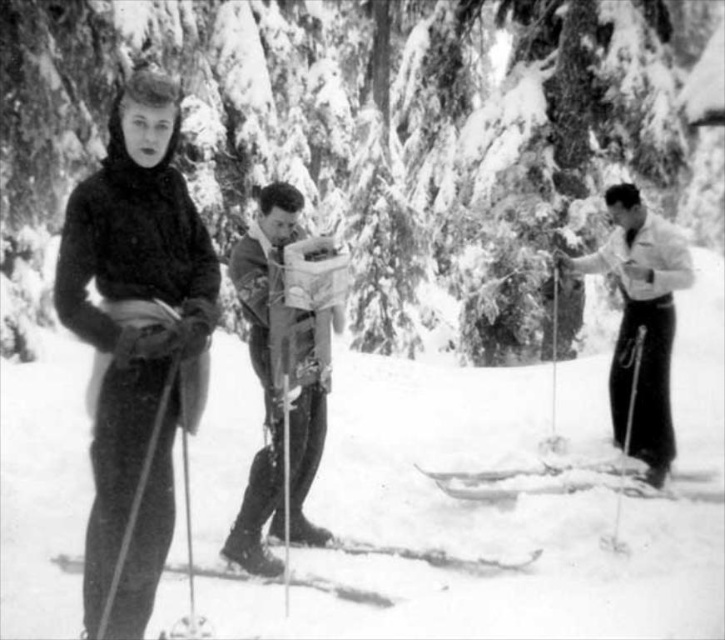
Question: Can you confirm if smooth snow at center is positioned to the left of smooth wood skis at center?

Choices:
 (A) yes
 (B) no

Answer: (B)

Question: Can you confirm if snowy evergreen tree at center is positioned to the right of smooth snow at center?

Choices:
 (A) yes
 (B) no

Answer: (A)

Question: Considering the real-world distances, which object is closest to the black matte ski suit at left?

Choices:
 (A) metallic ski pole at left
 (B) smooth snow at center

Answer: (A)

Question: Does white glossy skis at right have a greater width compared to metallic ski pole at left?

Choices:
 (A) yes
 (B) no

Answer: (A)

Question: Which of the following is the closest to the observer?

Choices:
 (A) (219, 340)
 (B) (624, 435)
 (C) (256, 538)

Answer: (C)

Question: Which point is closer to the camera?

Choices:
 (A) smooth snow at center
 (B) metallic silver ski pole at center

Answer: (A)